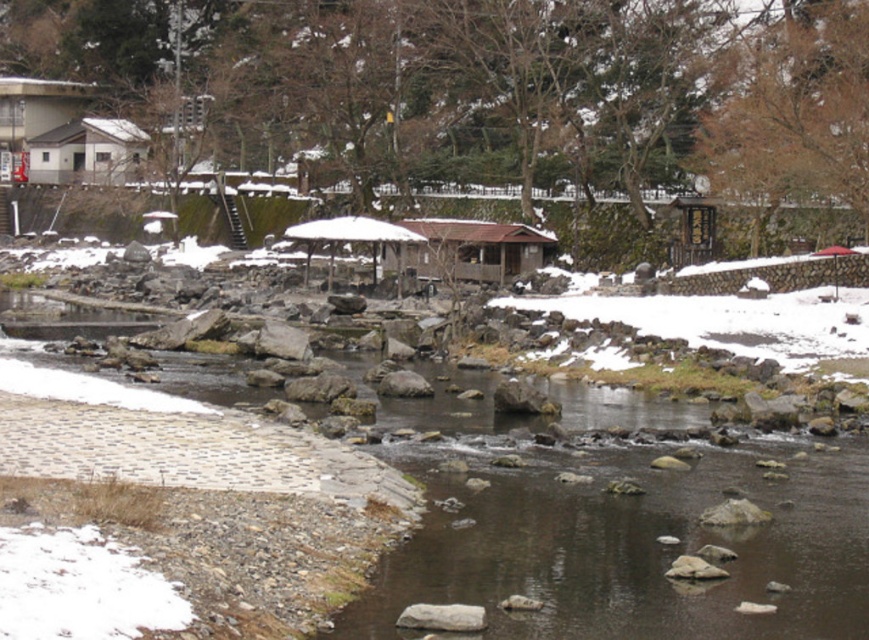
Question: Which of the following is the closest to the observer?

Choices:
 (A) white matte umbrella at center
 (B) white matte hut at upper left

Answer: (A)

Question: Which object is farther from the camera taking this photo?

Choices:
 (A) white matte umbrella at center
 (B) brown wooden hut at center
 (C) white matte hut at upper left

Answer: (C)

Question: Can you confirm if brown wooden hut at center is bigger than white matte umbrella at center?

Choices:
 (A) no
 (B) yes

Answer: (B)

Question: Is brown wooden hut at center smaller than white matte hut at upper left?

Choices:
 (A) no
 (B) yes

Answer: (B)

Question: Which of the following is the closest to the observer?

Choices:
 (A) (98, 118)
 (B) (475, 269)
 (C) (373, 275)

Answer: (C)

Question: Is brown wooden hut at center closer to the viewer compared to white matte umbrella at center?

Choices:
 (A) yes
 (B) no

Answer: (A)